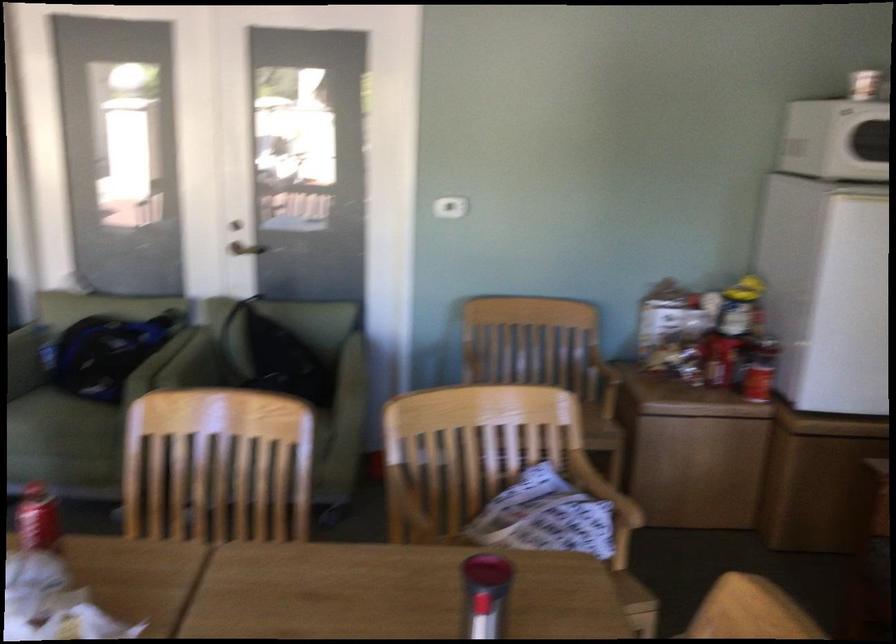
The location [37,518] corresponds to which object?

It corresponds to the red beverage can in the image.